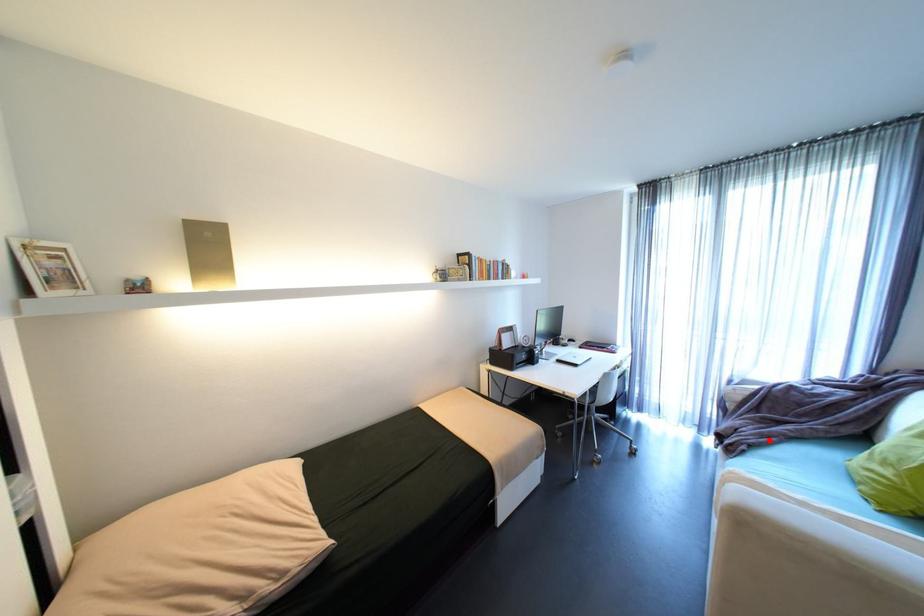
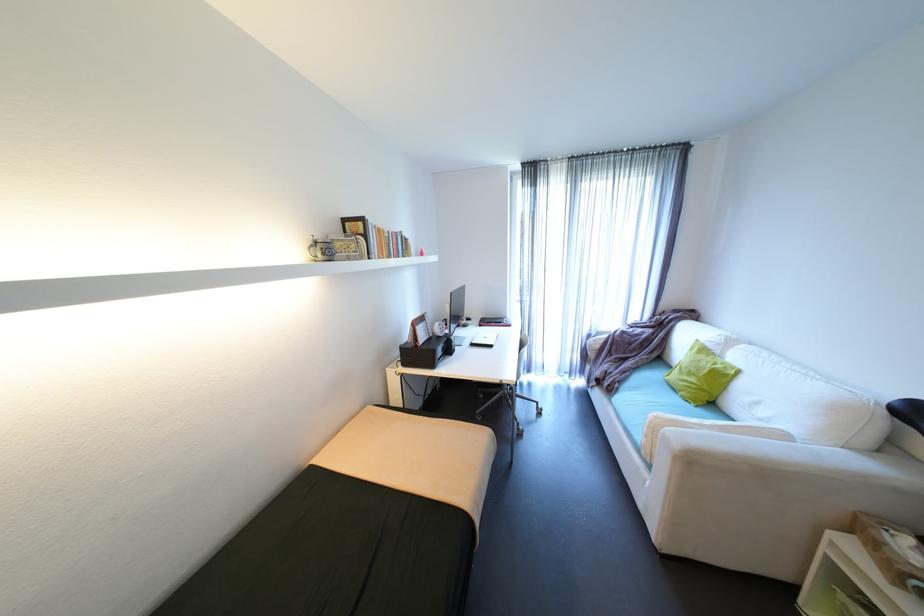
Where in the second image is the point corresponding to the highlighted location from the first image?

(630, 377)